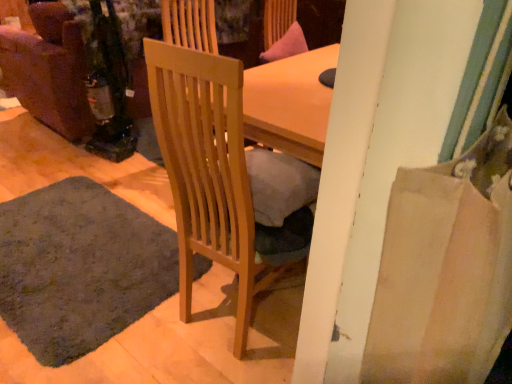
Find the location of a particular element. light wood chair at center is located at coordinates (207, 170).

What is the approximate height of light wood chair at center?

It is 3.52 feet.

This screenshot has height=384, width=512. What do you see at coordinates (207, 170) in the screenshot? I see `light wood chair at center` at bounding box center [207, 170].

Image resolution: width=512 pixels, height=384 pixels. What do you see at coordinates (80, 268) in the screenshot? I see `dark gray carpet at lower left` at bounding box center [80, 268].

Identify the location of dark gray carpet at lower left. This screenshot has height=384, width=512. (80, 268).

You are a GUI agent. You are given a task and a screenshot of the screen. Output one action in this format:
    pyautogui.click(x=<x>, y=<y>)
    Task: Click on the light wood chair at center
    
    Given the screenshot: What is the action you would take?
    pyautogui.click(x=207, y=170)

Considering the relative positions of light wood chair at center and dark gray carpet at lower left in the image provided, is light wood chair at center to the left or to the right of dark gray carpet at lower left?

From the image, it's evident that light wood chair at center is to the right of dark gray carpet at lower left.

Considering the positions of objects light wood chair at center and dark gray carpet at lower left in the image provided, who is behind, light wood chair at center or dark gray carpet at lower left?

dark gray carpet at lower left.

Is point (187, 202) closer to camera compared to point (129, 215)?

Yes, it is in front of point (129, 215).

From the image's perspective, which object appears higher, light wood chair at center or dark gray carpet at lower left?

light wood chair at center.

From a real-world perspective, is light wood chair at center physically above dark gray carpet at lower left?

Yes.

Which of these two, light wood chair at center or dark gray carpet at lower left, is thinner?

Thinner between the two is light wood chair at center.

Considering the sizes of light wood chair at center and dark gray carpet at lower left in the image, is light wood chair at center taller or shorter than dark gray carpet at lower left?

In the image, light wood chair at center appears to be taller than dark gray carpet at lower left.

Based on their sizes in the image, would you say light wood chair at center is bigger or smaller than dark gray carpet at lower left?

In the image, light wood chair at center appears to be larger than dark gray carpet at lower left.

Which is correct: light wood chair at center is inside dark gray carpet at lower left, or outside of it?

light wood chair at center is not enclosed by dark gray carpet at lower left.

Is light wood chair at center beside dark gray carpet at lower left?

They are not placed beside each other.

Could you tell me if light wood chair at center is turned towards dark gray carpet at lower left?

No, light wood chair at center is not oriented towards dark gray carpet at lower left.

What's the angular difference between light wood chair at center and dark gray carpet at lower left's facing directions?

The angle between the facing direction of light wood chair at center and the facing direction of dark gray carpet at lower left is 5.27 degrees.

Measure the distance from light wood chair at center to dark gray carpet at lower left.

light wood chair at center is 24.22 inches from dark gray carpet at lower left.

Image resolution: width=512 pixels, height=384 pixels. In order to click on chair that appears above the dark gray carpet at lower left (from a real-world perspective) in this screenshot , I will do `click(207, 170)`.

Considering the relative positions of dark gray carpet at lower left and light wood chair at center in the image provided, is dark gray carpet at lower left to the right of light wood chair at center from the viewer's perspective?

In fact, dark gray carpet at lower left is to the left of light wood chair at center.

Is dark gray carpet at lower left positioned before light wood chair at center?

No, it is behind light wood chair at center.

Is point (40, 343) closer or farther from the camera than point (216, 174)?

Point (40, 343) is positioned farther from the camera compared to point (216, 174).

From the image's perspective, relative to light wood chair at center, is dark gray carpet at lower left above or below?

dark gray carpet at lower left is situated lower than light wood chair at center in the image.

From a real-world perspective, relative to light wood chair at center, is dark gray carpet at lower left vertically above or below?

Clearly, from a real-world perspective, dark gray carpet at lower left is below light wood chair at center.

Does dark gray carpet at lower left have a greater width compared to light wood chair at center?

Yes.

Considering the relative sizes of dark gray carpet at lower left and light wood chair at center in the image provided, is dark gray carpet at lower left taller than light wood chair at center?

No, dark gray carpet at lower left is not taller than light wood chair at center.

Can you confirm if dark gray carpet at lower left is smaller than light wood chair at center?

Yes.

Would you say dark gray carpet at lower left is outside light wood chair at center?

That's correct, dark gray carpet at lower left is outside of light wood chair at center.

Are dark gray carpet at lower left and light wood chair at center located far from each other?

They are positioned close to each other.

Is dark gray carpet at lower left facing away from light wood chair at center?

No, dark gray carpet at lower left's orientation is not away from light wood chair at center.

How many degrees apart are the facing directions of dark gray carpet at lower left and light wood chair at center?

There is a 5.27-degree angle between the facing directions of dark gray carpet at lower left and light wood chair at center.

Locate an element on the screen. chair above the dark gray carpet at lower left (from a real-world perspective) is located at coordinates (207, 170).

Locate an element on the screen. This screenshot has height=384, width=512. chair that appears above the dark gray carpet at lower left (from the image's perspective) is located at coordinates (207, 170).

Image resolution: width=512 pixels, height=384 pixels. What are the coordinates of `mat on the left of light wood chair at center` in the screenshot? It's located at (80, 268).